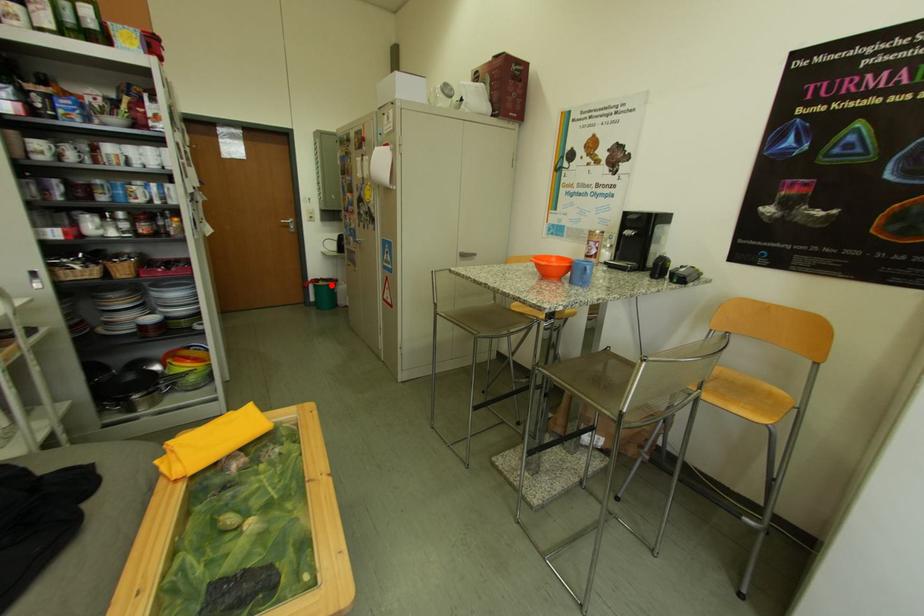
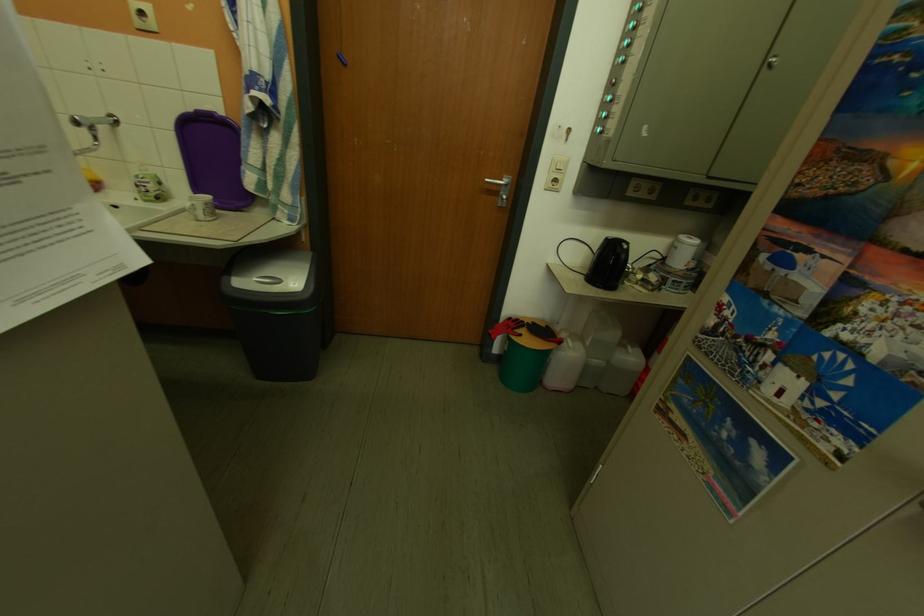
Where in the second image is the point corresponding to the highlighted location from the first image?

(533, 338)